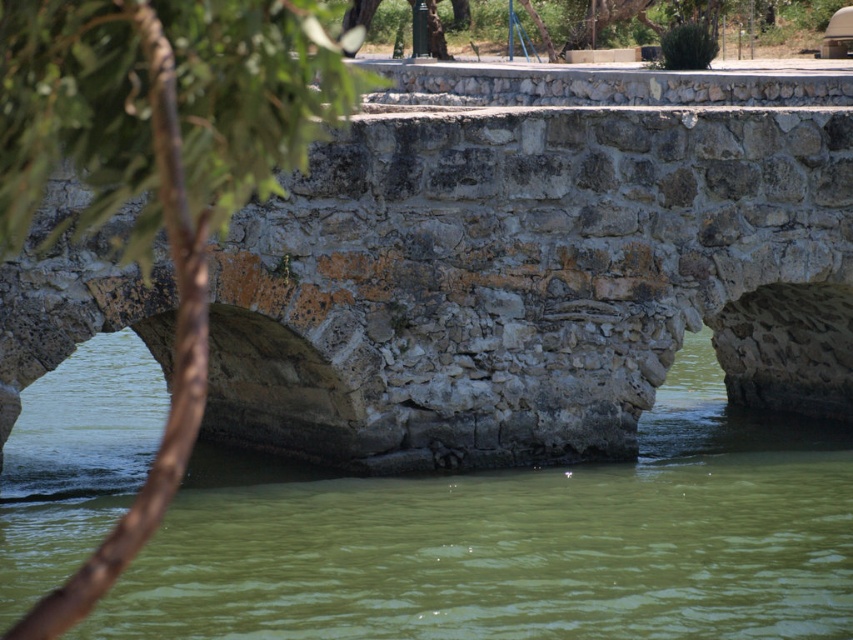
Question: Can you confirm if green stone river at center is positioned to the left of green leafy tree at upper center?

Choices:
 (A) yes
 (B) no

Answer: (A)

Question: Among these points, which one is farthest from the camera?

Choices:
 (A) (276, 122)
 (B) (635, 0)

Answer: (B)

Question: Is green stone river at center below green leafy branch at left?

Choices:
 (A) no
 (B) yes

Answer: (B)

Question: Is green stone river at center above green leafy tree at upper center?

Choices:
 (A) no
 (B) yes

Answer: (A)

Question: Which point appears farthest from the camera in this image?

Choices:
 (A) (432, 573)
 (B) (190, 1)

Answer: (A)

Question: Which of these objects is positioned farthest from the green leafy branch at left?

Choices:
 (A) green stone river at center
 (B) green leafy tree at upper center

Answer: (B)